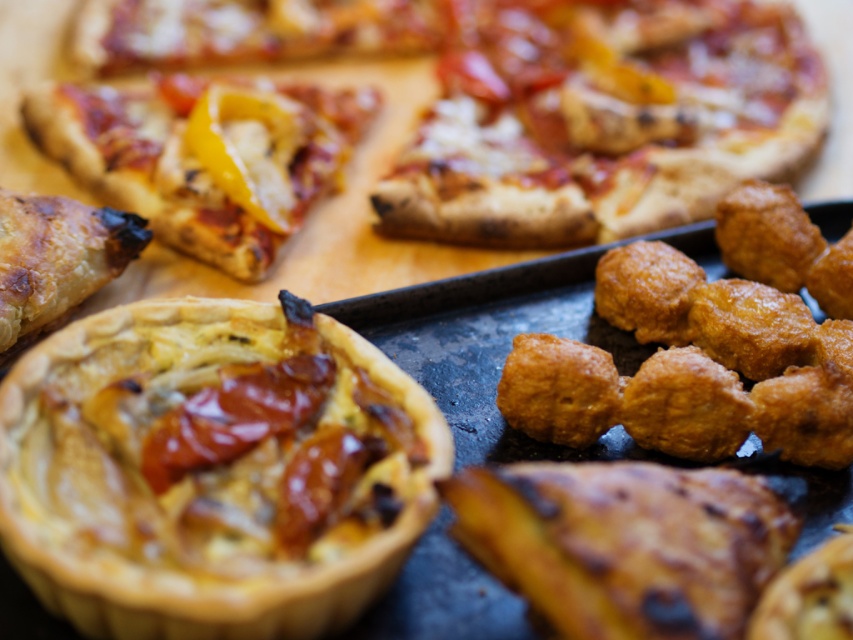
Does golden brown flaky pastry at lower right have a lesser width compared to golden-brown crispy pizza slice at upper left?

Indeed, golden brown flaky pastry at lower right has a lesser width compared to golden-brown crispy pizza slice at upper left.

Can you confirm if golden brown flaky pastry at lower right is taller than golden-brown crispy pizza slice at upper left?

In fact, golden brown flaky pastry at lower right may be shorter than golden-brown crispy pizza slice at upper left.

Does point (550, 500) come in front of point (308, 120)?

Yes, it is in front of point (308, 120).

Identify the location of golden brown flaky pastry at lower right. [x=625, y=544].

Image resolution: width=853 pixels, height=640 pixels. What do you see at coordinates (604, 120) in the screenshot?
I see `tomato sauce pizza at upper center` at bounding box center [604, 120].

Is tomato sauce pizza at upper center bigger than golden crispy pizza slice at upper left?

Yes.

Is point (653, 131) positioned in front of point (396, 12)?

Yes, it is.

Where is `tomato sauce pizza at upper center`? tomato sauce pizza at upper center is located at coordinates (604, 120).

Who is lower down, golden flaky tartlet at center or golden-brown crispy pizza slice at upper left?

golden flaky tartlet at center is lower down.

Who is higher up, golden flaky tartlet at center or golden-brown crispy pizza slice at upper left?

golden-brown crispy pizza slice at upper left is higher up.

Is point (82, 333) farther from viewer compared to point (306, 145)?

No, it is in front of (306, 145).

You are a GUI agent. You are given a task and a screenshot of the screen. Output one action in this format:
    pyautogui.click(x=<x>, y=<y>)
    Task: Click on the golden flaky tartlet at center
    This screenshot has height=640, width=853.
    Given the screenshot: What is the action you would take?
    212,472